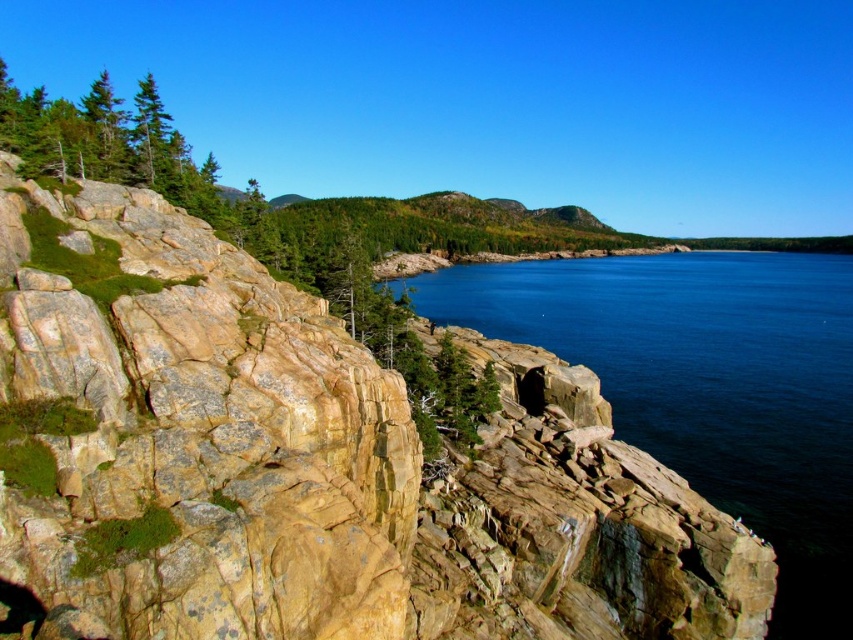
Is yellowish rock at left taller than blue smooth water at center?

No, yellowish rock at left is not taller than blue smooth water at center.

Is point (19, 605) farther from camera compared to point (805, 429)?

No, it is not.

Which is behind, point (65, 392) or point (761, 454)?

Positioned behind is point (761, 454).

The height and width of the screenshot is (640, 853). I want to click on yellowish rock at left, so click(189, 436).